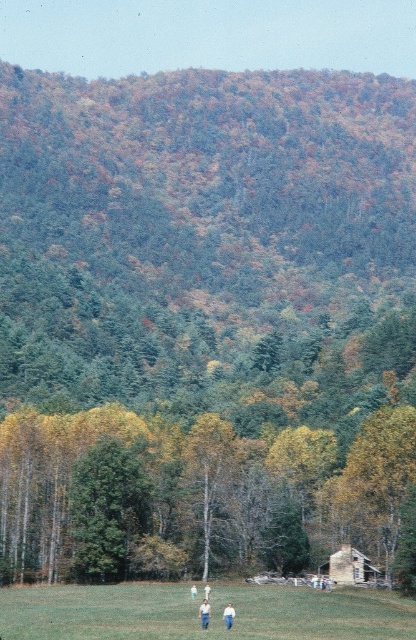
Question: Is yellow-green leaves at center closer to the viewer compared to white cotton shirt at center?

Choices:
 (A) no
 (B) yes

Answer: (A)

Question: Which point is farther to the camera?

Choices:
 (A) blue jeans at lower center
 (B) white cotton shirt at center
 (C) green grass at lower center
 (D) white cotton shirt at lower center

Answer: (B)

Question: Can you confirm if green grass at lower center is positioned to the left of light blue jeans at center?

Choices:
 (A) no
 (B) yes

Answer: (A)

Question: Is the position of white cotton shirt at lower center less distant than that of white cotton shirt at center?

Choices:
 (A) yes
 (B) no

Answer: (A)

Question: Which point is closer to the camera?

Choices:
 (A) green grass at lower center
 (B) light blue jeans at center
 (C) yellow-green leaves at center
 (D) blue jeans at lower center

Answer: (A)

Question: Which is nearer to the white cotton shirt at lower center?

Choices:
 (A) green grass at lower center
 (B) yellow-green leaves at center

Answer: (A)